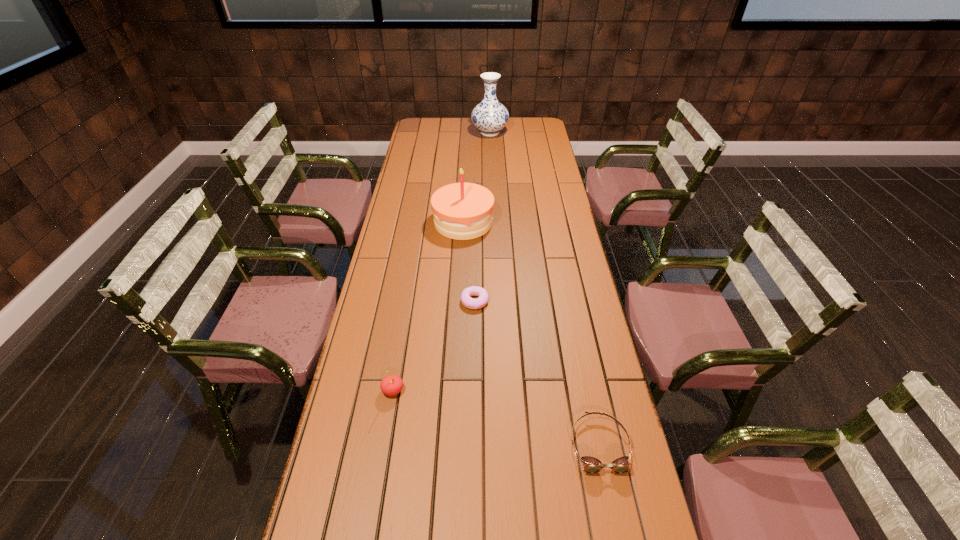
Locate an element on the screen. The image size is (960, 540). free space at the right edge of the desktop is located at coordinates (562, 243).

Where is `vacant region at the far left corner`? This screenshot has width=960, height=540. vacant region at the far left corner is located at coordinates (432, 132).

Locate an element on the screen. Image resolution: width=960 pixels, height=540 pixels. vacant region between the leftmost object and the vase is located at coordinates (442, 262).

Find the location of a particular element. The width and height of the screenshot is (960, 540). empty space that is in between the vase and the birthday cake is located at coordinates (476, 178).

Locate an element on the screen. The image size is (960, 540). free space between the second tallest object and the fourth tallest object is located at coordinates (531, 334).

Identify the location of free area in between the third nearest object and the nearest object. (537, 373).

Where is `free spot between the birthday cake and the rightmost object`? This screenshot has width=960, height=540. free spot between the birthday cake and the rightmost object is located at coordinates (531, 334).

The height and width of the screenshot is (540, 960). Identify the location of free point between the fourth shortest object and the farthest object. (476, 178).

Identify the location of unoccupied position between the shortest object and the second tallest object. The height and width of the screenshot is (540, 960). (469, 261).

Locate an element on the screen. Image resolution: width=960 pixels, height=540 pixels. free spot between the leftmost object and the farthest object is located at coordinates (442, 262).